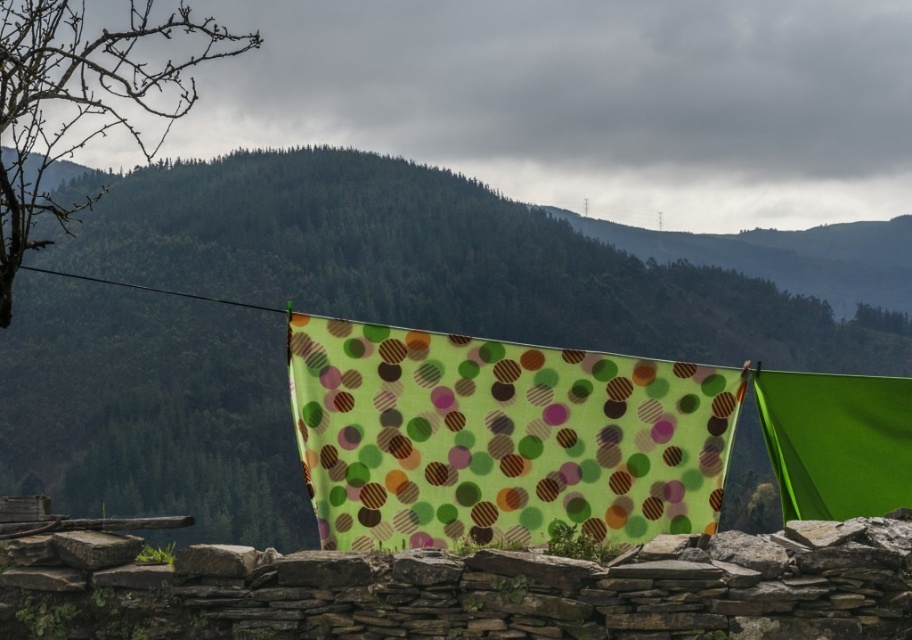
Question: Considering the relative positions of green polka dot fabric at center and green fabric at center in the image provided, where is green polka dot fabric at center located with respect to green fabric at center?

Choices:
 (A) above
 (B) below

Answer: (B)

Question: Is green fabric at center to the left of black wire at upper left from the viewer's perspective?

Choices:
 (A) yes
 (B) no

Answer: (B)

Question: Which object is positioned farthest from the bare branches at left?

Choices:
 (A) black wire at upper left
 (B) green polka dot fabric at center

Answer: (B)

Question: Is green fabric at center to the left of bare branches at left from the viewer's perspective?

Choices:
 (A) no
 (B) yes

Answer: (A)

Question: Which object is the closest to the bare branches at left?

Choices:
 (A) green fabric at center
 (B) black wire at upper left

Answer: (B)

Question: Among these objects, which one is farthest from the camera?

Choices:
 (A) green fabric at center
 (B) black wire at upper left
 (C) bare branches at left

Answer: (A)